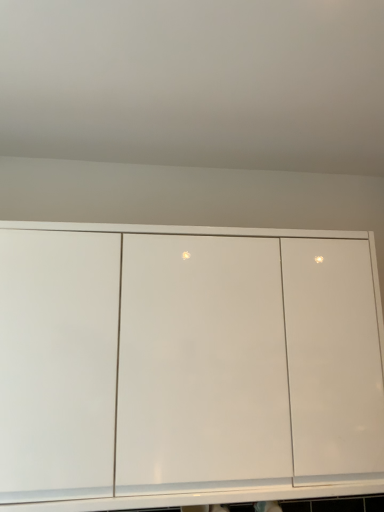
At what (x,y) coordinates should I click in order to perform the action: click on white glossy cupboard at center. Please return your answer as a coordinate pair (x, y). The width and height of the screenshot is (384, 512). Looking at the image, I should click on (188, 362).

This screenshot has width=384, height=512. What do you see at coordinates (188, 362) in the screenshot?
I see `white glossy cupboard at center` at bounding box center [188, 362].

This screenshot has height=512, width=384. Identify the location of white glossy cupboard at center. (188, 362).